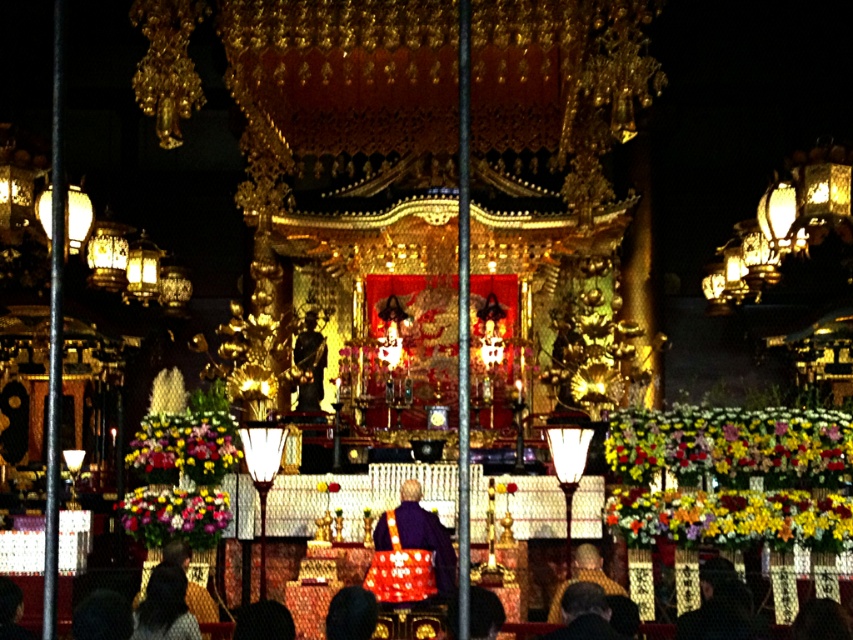
Is point (445, 536) positioned in front of point (556, 605)?

Yes, it is.

Which of these two, matte purple kimono at center or golden robe at center, stands taller?

golden robe at center

Does point (416, 515) come in front of point (550, 616)?

That is False.

I want to click on matte purple kimono at center, so click(x=410, y=552).